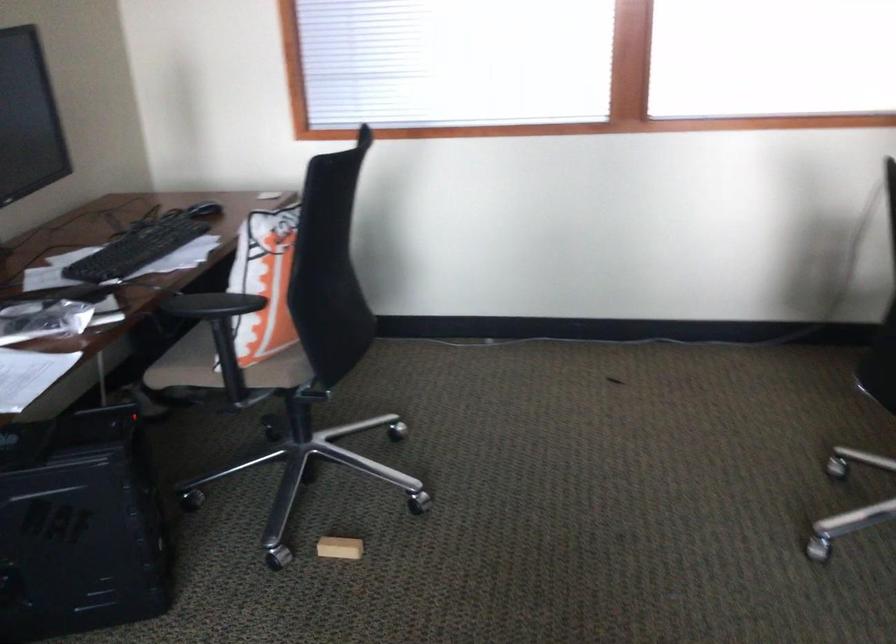
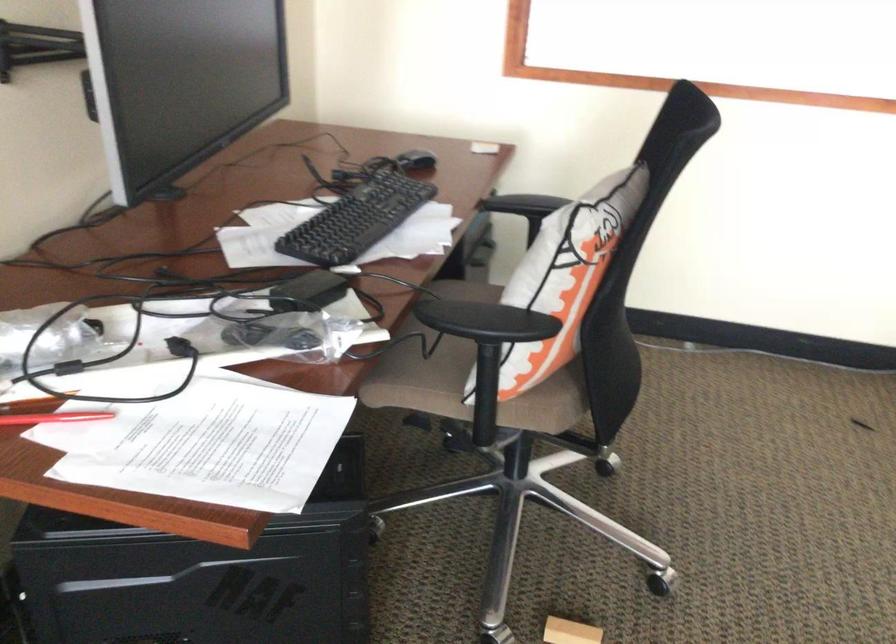
Where in the second image is the point corresponding to point (204, 210) from the first image?

(416, 162)